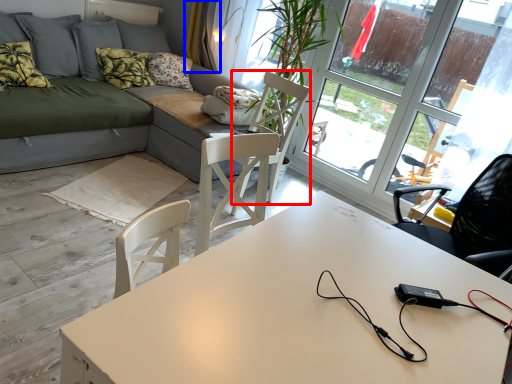
Question: Which of the following is the farthest to the observer, swivel chair (highlighted by a red box) or curtain (highlighted by a blue box)?

Choices:
 (A) swivel chair
 (B) curtain

Answer: (B)